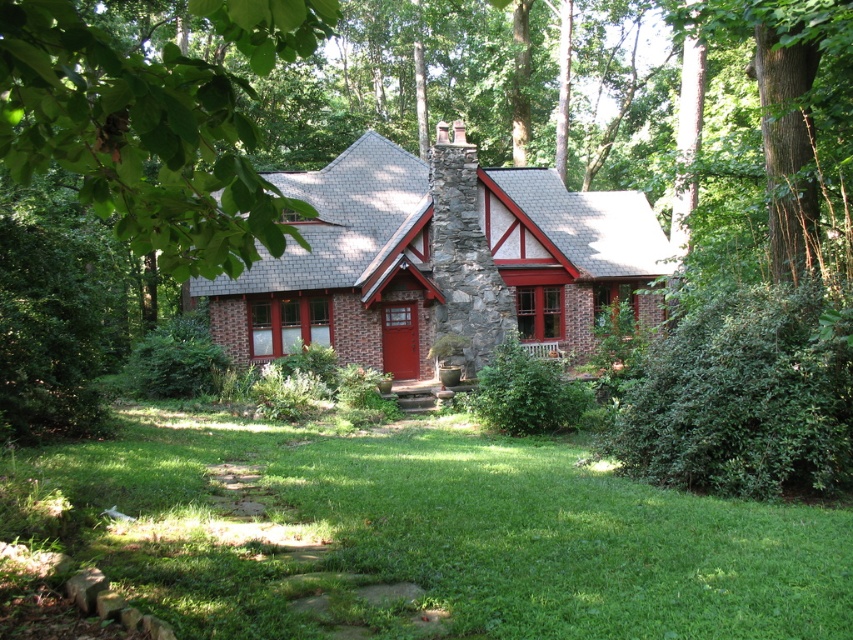
Does brick house at center come in front of green leafy tree at upper left?

That is False.

Is brick house at center shorter than green leafy tree at upper left?

No, brick house at center is not shorter than green leafy tree at upper left.

Which is behind, point (447, 282) or point (26, 48)?

Point (447, 282)

You are a GUI agent. You are given a task and a screenshot of the screen. Output one action in this format:
    pyautogui.click(x=<x>, y=<y>)
    Task: Click on the brick house at center
    The width and height of the screenshot is (853, 640).
    Given the screenshot: What is the action you would take?
    pyautogui.click(x=438, y=260)

Can you confirm if green grass at center is positioned above green leafy tree at upper left?

Actually, green grass at center is below green leafy tree at upper left.

Can you confirm if green grass at center is taller than green leafy tree at upper left?

No.

Which is behind, point (178, 458) or point (190, 179)?

Positioned behind is point (178, 458).

The image size is (853, 640). Find the location of `green grass at center`. green grass at center is located at coordinates (434, 536).

Is green grass at center taller than brick house at center?

Incorrect, green grass at center's height is not larger of brick house at center's.

This screenshot has width=853, height=640. What do you see at coordinates (434, 536) in the screenshot? I see `green grass at center` at bounding box center [434, 536].

Identify the location of green grass at center. (434, 536).